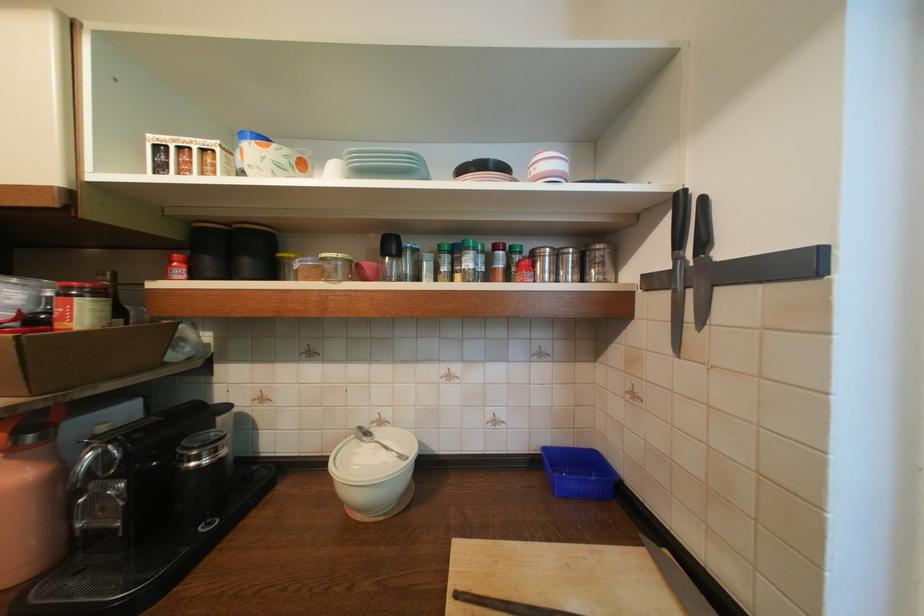
I want to click on white container lid, so click(384, 164).